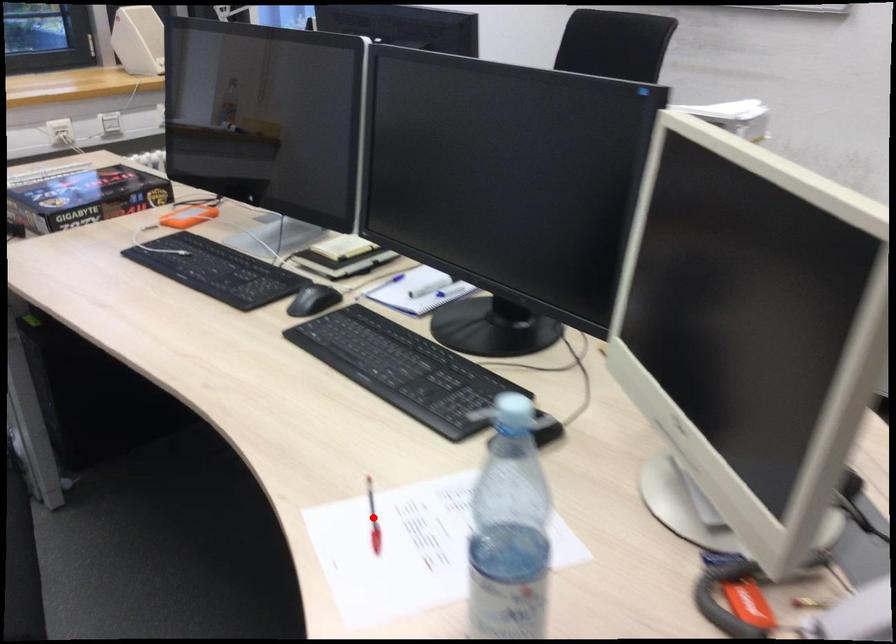
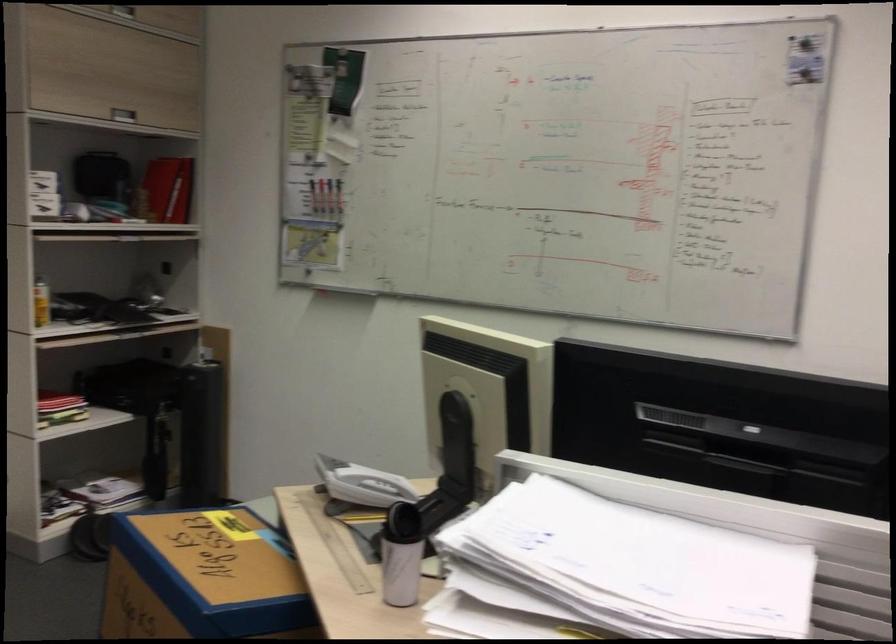
Question: I am providing you with two images of the same scene from different viewpoints. A red point is marked on the first image. Is the red point's position out of view in image 2?

Choices:
 (A) Yes
 (B) No

Answer: (A)